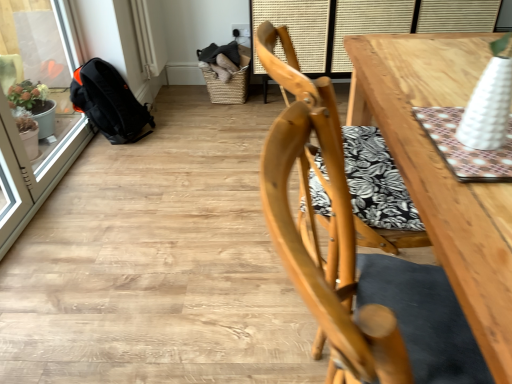
Image resolution: width=512 pixels, height=384 pixels. Describe the element at coordinates (298, 27) in the screenshot. I see `wooden table at upper right` at that location.

Describe the element at coordinates (49, 98) in the screenshot. The image size is (512, 384). I see `transparent glass screen door at left` at that location.

What is the approximate width of black fabric backpack at left?

black fabric backpack at left is 36.37 centimeters in width.

Describe the element at coordinates (227, 86) in the screenshot. The height and width of the screenshot is (384, 512). I see `woven brown basket at upper center` at that location.

Find the location of a particular element. The width and height of the screenshot is (512, 384). light wood chair at center is located at coordinates (357, 262).

Between light wood chair at center and black fabric backpack at left, which one has smaller size?

black fabric backpack at left.

Are light wood chair at center and black fabric backpack at left located far from each other?

Yes, light wood chair at center and black fabric backpack at left are quite far apart.

Is light wood chair at center positioned beyond the bounds of black fabric backpack at left?

Yes.

From a real-world perspective, which is physically above, light wood chair at center or black fabric backpack at left?

light wood chair at center is physically above.

Is transparent glass screen door at left in front of or behind black fabric backpack at left in the image?

transparent glass screen door at left is positioned closer to the viewer than black fabric backpack at left.

In terms of width, does transparent glass screen door at left look wider or thinner when compared to black fabric backpack at left?

In the image, transparent glass screen door at left appears to be more narrow than black fabric backpack at left.

Is transparent glass screen door at left taller or shorter than black fabric backpack at left?

transparent glass screen door at left is taller than black fabric backpack at left.

Which object is closer to the camera taking this photo, light wood chair at center or wooden table at upper right?

light wood chair at center is closer to the camera.

Looking at their sizes, would you say light wood chair at center is wider or thinner than wooden table at upper right?

In the image, light wood chair at center appears to be wider than wooden table at upper right.

Would you consider light wood chair at center to be distant from wooden table at upper right?

Yes, light wood chair at center is far from wooden table at upper right.

From the image's perspective, between black fabric backpack at left and transparent glass screen door at left, which one is located above?

black fabric backpack at left, from the image's perspective.

Can you confirm if black fabric backpack at left is shorter than transparent glass screen door at left?

Yes.

Which of these two, black fabric backpack at left or transparent glass screen door at left, is smaller?

Smaller between the two is black fabric backpack at left.

What's the angular difference between black fabric backpack at left and transparent glass screen door at left's facing directions?

0.447 degrees.

Which of these two, light wood chair at center or transparent glass screen door at left, is wider?

light wood chair at center.

From the image's perspective, relative to transparent glass screen door at left, is light wood chair at center above or below?

light wood chair at center is situated lower than transparent glass screen door at left in the image.

Could you tell me if light wood chair at center is facing transparent glass screen door at left?

No, light wood chair at center is not oriented towards transparent glass screen door at left.

Measure the distance from light wood chair at center to transparent glass screen door at left.

light wood chair at center is 1.57 meters away from transparent glass screen door at left.

Does point (358, 1) come farther from viewer compared to point (246, 69)?

No, it is not.

Does wooden table at upper right turn towards woven brown basket at upper center?

No.

Looking at this image, between wooden table at upper right and woven brown basket at upper center, which one has larger width?

wooden table at upper right.

From the image's perspective, who appears lower, wooden table at upper right or woven brown basket at upper center?

woven brown basket at upper center is shown below in the image.

Locate an element on the screen. The width and height of the screenshot is (512, 384). backpack below the wooden table at upper right (from the image's perspective) is located at coordinates (109, 102).

Considering the sizes of wooden table at upper right and black fabric backpack at left in the image, is wooden table at upper right bigger or smaller than black fabric backpack at left?

Considering their sizes, wooden table at upper right takes up more space than black fabric backpack at left.

How much distance is there between wooden table at upper right and black fabric backpack at left?

They are 3.72 feet apart.

Is wooden table at upper right next to black fabric backpack at left and touching it?

No, wooden table at upper right is not beside black fabric backpack at left.

Find the location of `backpack located behind the light wood chair at center`. backpack located behind the light wood chair at center is located at coordinates (109, 102).

What are the coordinates of `screen door below the black fabric backpack at left (from the image's perspective)` in the screenshot? It's located at (49, 98).

Estimate the real-world distances between objects in this image. Which object is closer to transparent glass screen door at left, light wood chair at center or woven brown basket at upper center?

woven brown basket at upper center lies closer to transparent glass screen door at left than the other object.

Based on their spatial positions, is wooden table at upper right or woven brown basket at upper center further from light wood chair at center?

woven brown basket at upper center is further to light wood chair at center.

Which object lies further to the anchor point transparent glass screen door at left, wooden table at upper right or light wood chair at center?

The object further to transparent glass screen door at left is light wood chair at center.

Which object lies nearer to the anchor point woven brown basket at upper center, black fabric backpack at left or wooden table at upper right?

wooden table at upper right lies closer to woven brown basket at upper center than the other object.

From the picture: From the image, which object appears to be nearer to black fabric backpack at left, transparent glass screen door at left or light wood chair at center?

transparent glass screen door at left.

When comparing their distances from wooden table at upper right, does woven brown basket at upper center or transparent glass screen door at left seem further?

transparent glass screen door at left is further to wooden table at upper right.

When comparing their distances from black fabric backpack at left, does transparent glass screen door at left or woven brown basket at upper center seem closer?

transparent glass screen door at left.

Which object lies nearer to the anchor point black fabric backpack at left, woven brown basket at upper center or wooden table at upper right?

woven brown basket at upper center lies closer to black fabric backpack at left than the other object.

This screenshot has height=384, width=512. In order to click on chair between transparent glass screen door at left and wooden table at upper right in the horizontal direction in this screenshot , I will do `click(357, 262)`.

This screenshot has width=512, height=384. In order to click on basket situated between transparent glass screen door at left and wooden table at upper right from left to right in this screenshot , I will do `click(227, 86)`.

The image size is (512, 384). Find the location of `screen door between light wood chair at center and black fabric backpack at left from front to back`. screen door between light wood chair at center and black fabric backpack at left from front to back is located at coordinates (49, 98).

The image size is (512, 384). I want to click on backpack between light wood chair at center and wooden table at upper right in the front-back direction, so click(x=109, y=102).